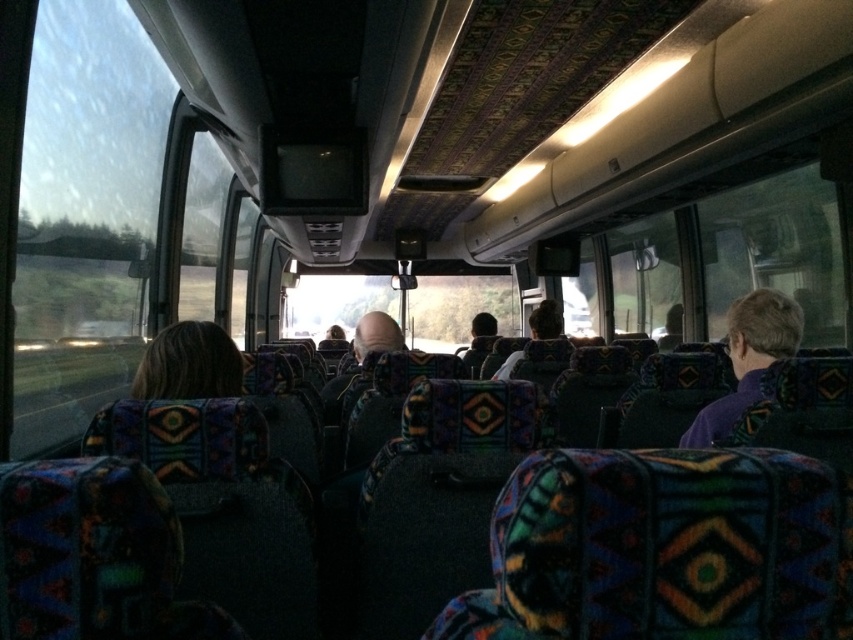
Does blonde hair at center have a greater height compared to smooth bald head at center?

No, blonde hair at center is not taller than smooth bald head at center.

Describe the element at coordinates (189, 364) in the screenshot. I see `blonde hair at center` at that location.

Image resolution: width=853 pixels, height=640 pixels. In order to click on blonde hair at center in this screenshot , I will do `click(189, 364)`.

Identify the location of blonde hair at center. This screenshot has width=853, height=640. (189, 364).

Identify the location of smooth bald head at center. (375, 336).

Is smooth bald head at center below dark brown hair at center?

No.

The width and height of the screenshot is (853, 640). What do you see at coordinates (375, 336) in the screenshot?
I see `smooth bald head at center` at bounding box center [375, 336].

The width and height of the screenshot is (853, 640). I want to click on smooth bald head at center, so click(x=375, y=336).

Between purple fabric at right and blonde hair at center, which one appears on the left side from the viewer's perspective?

Positioned to the left is blonde hair at center.

This screenshot has width=853, height=640. Describe the element at coordinates (747, 358) in the screenshot. I see `purple fabric at right` at that location.

Which is in front, point (772, 292) or point (222, 388)?

Point (222, 388) is in front.

I want to click on purple fabric at right, so click(747, 358).